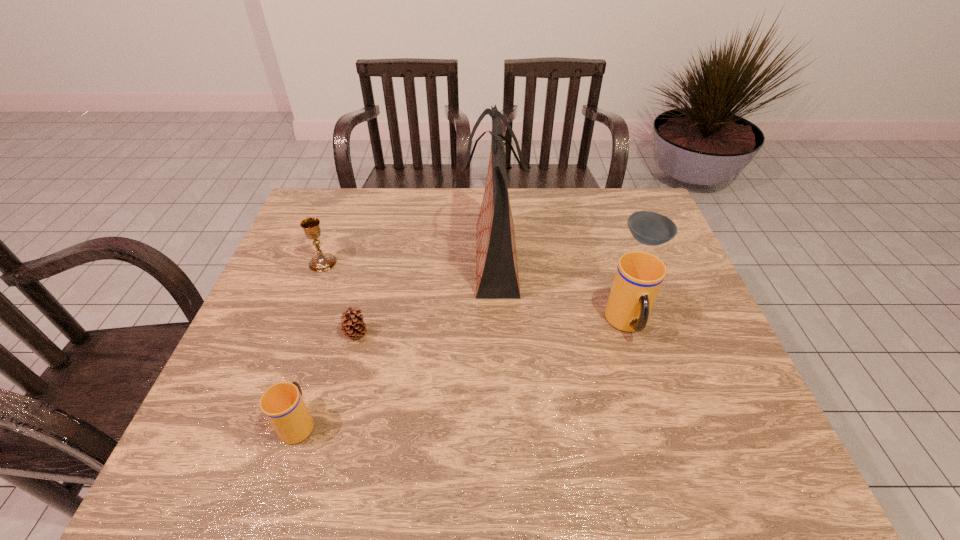
I want to click on vacant area that lies between the tallest object and the fifth object from left to right, so click(x=561, y=292).

This screenshot has width=960, height=540. In order to click on empty space that is in between the third object from right to left and the fourth shortest object in this screenshot , I will do `click(408, 261)`.

Point out which object is positioned as the nearest to the second tallest object. Please provide its 2D coordinates. Your answer should be formatted as a tuple, i.e. [(x, y)], where the tuple contains the x and y coordinates of a point satisfying the conditions above.

[(649, 228)]

Select which object is the closest to the fourth object from left to right. Please provide its 2D coordinates. Your answer should be formatted as a tuple, i.e. [(x, y)], where the tuple contains the x and y coordinates of a point satisfying the conditions above.

[(639, 275)]

Identify the location of vacant region that satisfies the following two spatial constraints: 1. on the side of the bowl with the handle; 2. on the left side of the nearer cup. The image size is (960, 540). (356, 240).

At what (x,y) coordinates should I click in order to perform the action: click on free space that satisfies the following two spatial constraints: 1. on the side of the shorter cup with the handle; 2. on the left side of the fourth object from right to left. Please return your answer as a coordinate pair (x, y). This screenshot has height=540, width=960. Looking at the image, I should click on (326, 334).

Where is `blank space that satisfies the following two spatial constraints: 1. on the back side of the shortest object; 2. on the left side of the leftmost object`? Image resolution: width=960 pixels, height=540 pixels. blank space that satisfies the following two spatial constraints: 1. on the back side of the shortest object; 2. on the left side of the leftmost object is located at coordinates (331, 240).

Where is `free spot that satisfies the following two spatial constraints: 1. on the side of the shortest object with the handle; 2. on the left side of the nearer cup`? This screenshot has width=960, height=540. free spot that satisfies the following two spatial constraints: 1. on the side of the shortest object with the handle; 2. on the left side of the nearer cup is located at coordinates (356, 240).

You are a GUI agent. You are given a task and a screenshot of the screen. Output one action in this format:
    pyautogui.click(x=<x>, y=<y>)
    Task: Click on the vacant position in the image that satisfies the following two spatial constraints: 1. on the side of the shorter cup with the handle; 2. on the left side of the shortest object
    Image resolution: width=960 pixels, height=540 pixels.
    Given the screenshot: What is the action you would take?
    pyautogui.click(x=356, y=240)

Find the location of a particular element. The image size is (960, 540). free spot that satisfies the following two spatial constraints: 1. on the side of the bowl with the handle; 2. on the left side of the nearest object is located at coordinates (356, 240).